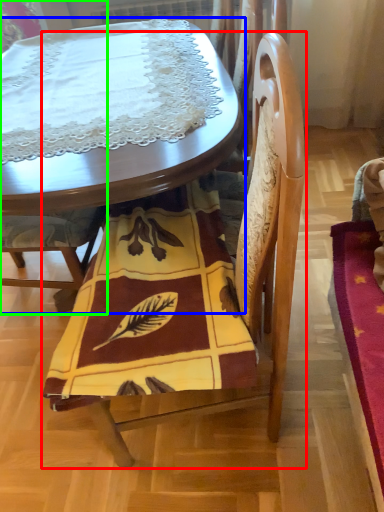
Question: Which object is the closest to the chair (highlighted by a red box)? Choose among these: table (highlighted by a blue box) or chair (highlighted by a green box).

Choices:
 (A) table
 (B) chair

Answer: (A)